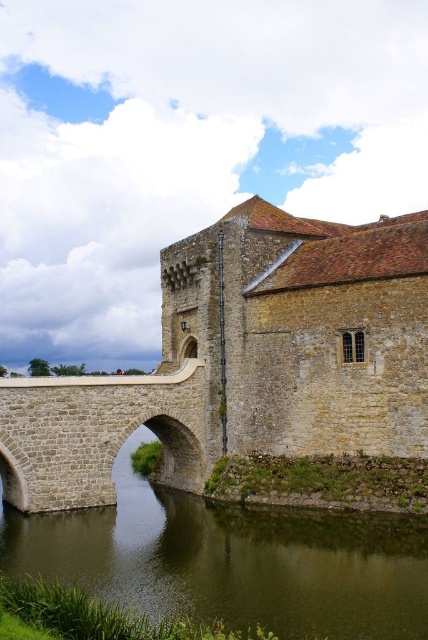
Does point (172, 541) come behind point (68, 444)?

No, it is in front of (68, 444).

Between point (258, 509) and point (133, 396), which one is positioned behind?

Positioned behind is point (133, 396).

In order to click on green stone water at center in this screenshot , I will do `click(231, 561)`.

Which is above, stone brick castle at center or green stone water at center?

stone brick castle at center is above.

Does stone brick castle at center appear under green stone water at center?

No, stone brick castle at center is not below green stone water at center.

Does point (137, 384) come farther from viewer compared to point (155, 508)?

No.

Find the location of a particular element. stone brick castle at center is located at coordinates (244, 360).

Which is behind, point (269, 413) or point (112, 406)?

Positioned behind is point (269, 413).

Who is taller, stone brick castle at center or stone bridge at center?

Standing taller between the two is stone brick castle at center.

Where is `stone brick castle at center`? The image size is (428, 640). stone brick castle at center is located at coordinates point(244,360).

Find the location of a particular element. This screenshot has width=428, height=640. stone brick castle at center is located at coordinates (244, 360).